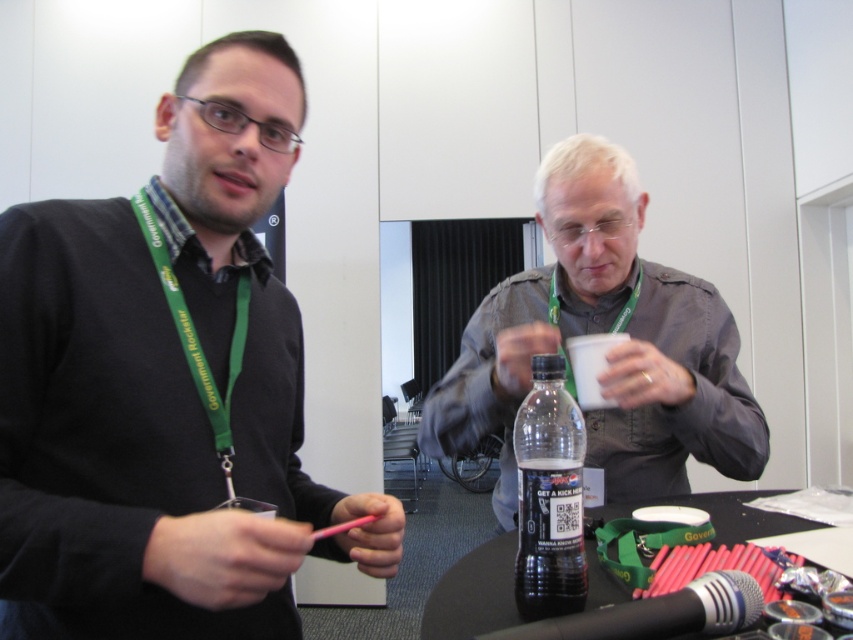
Question: From the image, what is the correct spatial relationship of gray matte shirt at center in relation to green fabric lanyard at left?

Choices:
 (A) right
 (B) left

Answer: (A)

Question: Which point is farther to the camera?

Choices:
 (A) (590, 566)
 (B) (245, 339)
 (C) (51, 358)

Answer: (A)

Question: Which is nearer to the clear plastic bottle at center?

Choices:
 (A) green fabric lanyard at left
 (B) gray matte shirt at center
 (C) matte black sweater at left

Answer: (B)

Question: Does matte black sweater at left appear on the left side of green fabric lanyard at left?

Choices:
 (A) yes
 (B) no

Answer: (B)

Question: Does clear plastic bottle at center appear on the right side of black plastic bottle at center?

Choices:
 (A) no
 (B) yes

Answer: (A)

Question: Which object is closer to the camera taking this photo?

Choices:
 (A) gray matte shirt at center
 (B) green fabric lanyard at left
 (C) black plastic bottle at center
 (D) clear plastic bottle at center

Answer: (B)